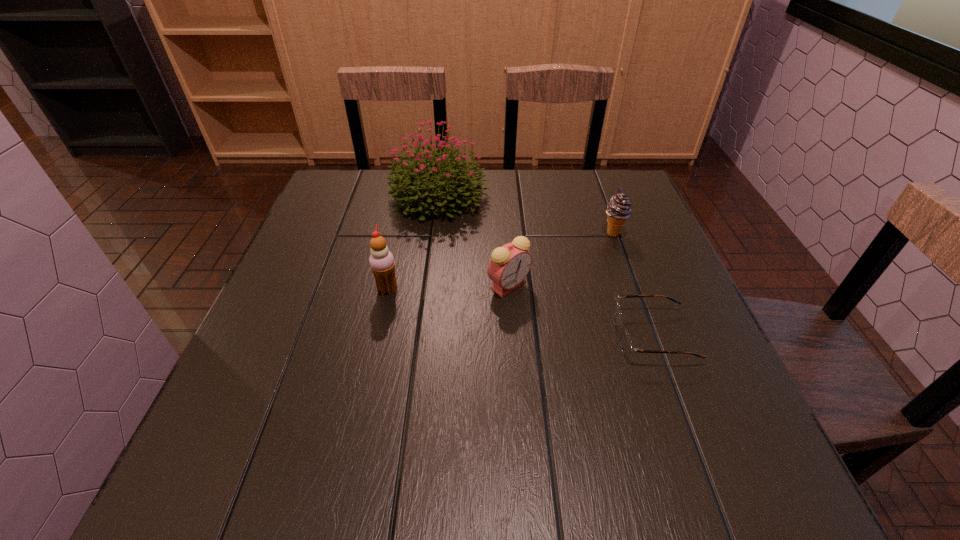
Where is `free space located 0.360m at the front with a straw on the nearer icecream`? This screenshot has width=960, height=540. free space located 0.360m at the front with a straw on the nearer icecream is located at coordinates click(564, 289).

Where is `vacant region located on the left of the right icecream`? This screenshot has height=540, width=960. vacant region located on the left of the right icecream is located at coordinates (443, 233).

Find the location of a particular element. The height and width of the screenshot is (540, 960). free space located on the face of the alarm clock is located at coordinates (516, 380).

Where is `free location located 0.250m on the front-facing side of the spectacles`? The height and width of the screenshot is (540, 960). free location located 0.250m on the front-facing side of the spectacles is located at coordinates (489, 336).

Find the location of a particular element. vacant space located 0.070m on the front-facing side of the spectacles is located at coordinates (580, 336).

Where is `free spot located 0.250m on the front-facing side of the spectacles`? free spot located 0.250m on the front-facing side of the spectacles is located at coordinates (489, 336).

You are a GUI agent. You are given a task and a screenshot of the screen. Output one action in this format:
    pyautogui.click(x=<x>, y=<y>)
    Task: Click on the object located at the far edge
    The image size is (960, 540).
    Given the screenshot: What is the action you would take?
    pyautogui.click(x=413, y=183)

Locate an element on the screen. icecream that is at the right edge is located at coordinates (618, 210).

The height and width of the screenshot is (540, 960). What are the coordinates of `spectacles located at the right edge` in the screenshot? It's located at click(x=627, y=347).

What are the coordinates of `vacant space at the far edge of the desktop` in the screenshot? It's located at (554, 205).